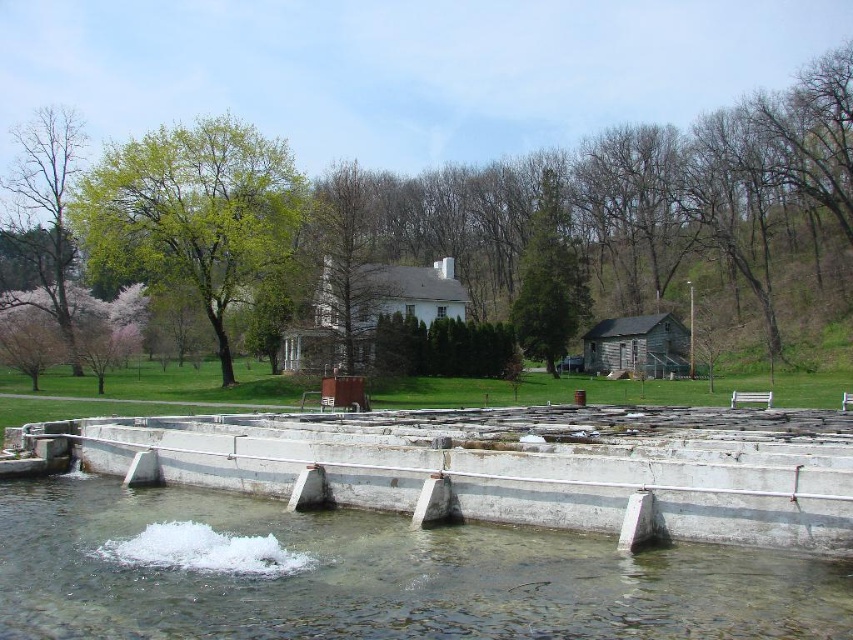
Is clear concrete water at center below white concrete dam at lower center?

Indeed, clear concrete water at center is positioned under white concrete dam at lower center.

Can you confirm if clear concrete water at center is positioned to the left of white concrete dam at lower center?

Yes, clear concrete water at center is to the left of white concrete dam at lower center.

Does point (546, 563) come behind point (640, 518)?

No, it is not.

At what (x,y) coordinates should I click in order to perform the action: click on clear concrete water at center. Please return your answer as a coordinate pair (x, y). The height and width of the screenshot is (640, 853). Looking at the image, I should click on point(370,576).